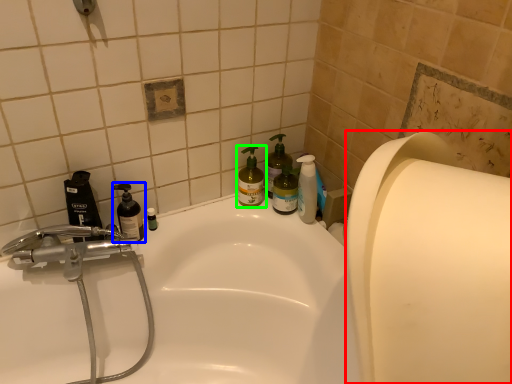
Question: Based on their relative distances, which object is farther from paper towel (highlighted by a red box)? Choose from cleaning product (highlighted by a blue box) and cleaning product (highlighted by a green box).

Choices:
 (A) cleaning product
 (B) cleaning product

Answer: (A)